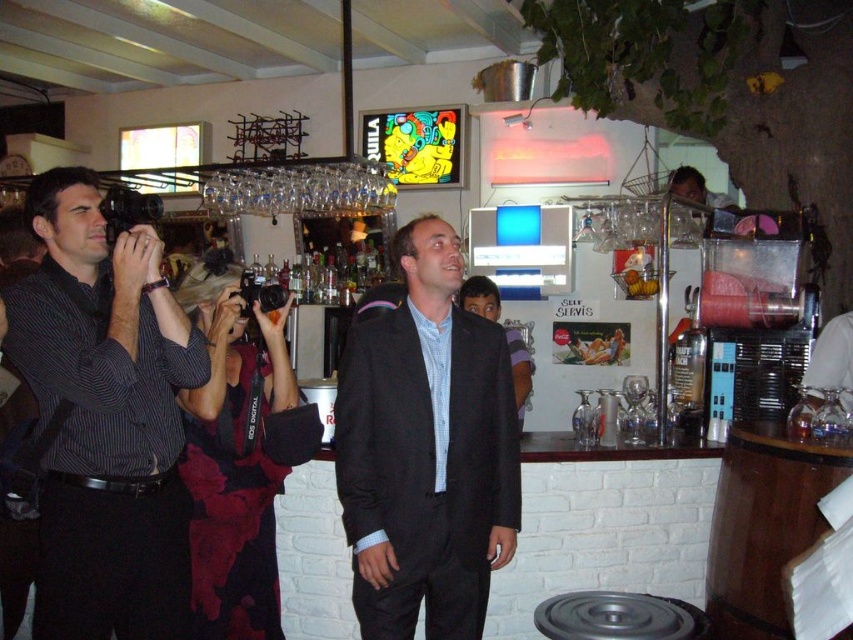
You are a photographer at the event and need to decide which outfit to wear tomorrow. Based on the image, which clothing item is bigger in size between the striped cotton shirt at left and the black matte suit at center?

The striped cotton shirt at left is larger in size compared to the black matte suit at center.

You are standing at point (105, 419) in the image. What object is located exactly at this point?

The striped cotton shirt at left is located exactly at point (105, 419).